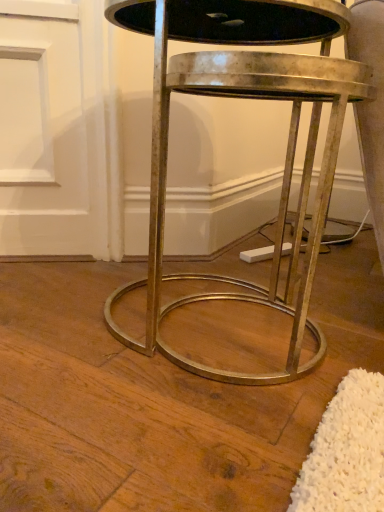
Question: Should I look upward or downward to see metallic gold table at center?

Choices:
 (A) down
 (B) up

Answer: (B)